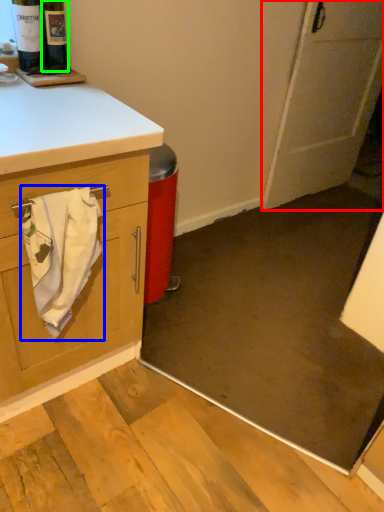
Question: Which is nearer to the door (highlighted by a red box)? bath towel (highlighted by a blue box) or wine bottle (highlighted by a green box).

Choices:
 (A) bath towel
 (B) wine bottle

Answer: (B)